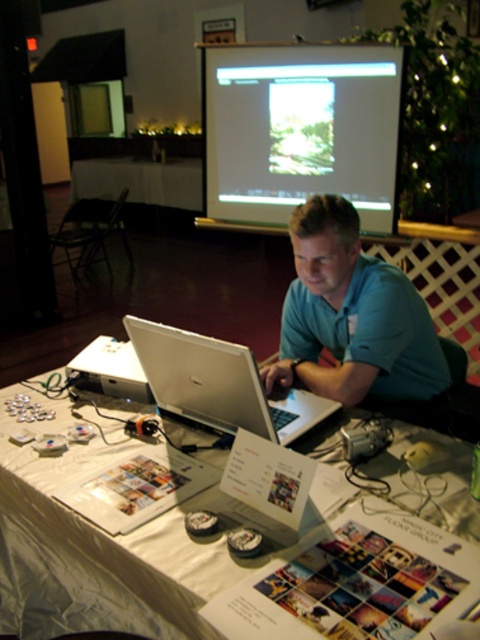
Question: Which of the following is the farthest from the observer?

Choices:
 (A) (134, 321)
 (B) (216, 193)

Answer: (B)

Question: Does matte silver laptop at upper center have a larger size compared to silver metallic laptop at center?

Choices:
 (A) yes
 (B) no

Answer: (A)

Question: From the image, what is the correct spatial relationship of white glossy table at center in relation to white plastic projector at lower left?

Choices:
 (A) above
 (B) below

Answer: (A)

Question: Does white plastic table at center come behind white plastic projector at lower left?

Choices:
 (A) no
 (B) yes

Answer: (A)

Question: Which point appears farthest from the camera in this image?

Choices:
 (A) (116, 369)
 (B) (204, 412)
 (C) (186, 161)
 (D) (275, 369)

Answer: (C)

Question: Which of the following is the closest to the observer?

Choices:
 (A) blue smooth shirt at center
 (B) white glossy table at center
 (C) silver metallic laptop at center

Answer: (C)